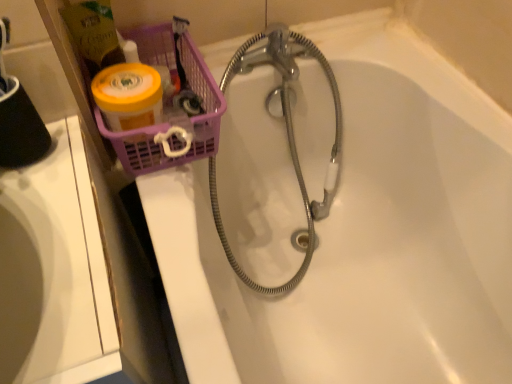
Question: From a real-world perspective, is white glossy sink at left physically located above or below white glossy bathtub at upper center?

Choices:
 (A) above
 (B) below

Answer: (B)

Question: Is white glossy sink at left taller or shorter than white glossy bathtub at upper center?

Choices:
 (A) short
 (B) tall

Answer: (B)

Question: Which object is positioned closest to the translucent plastic basket at upper left?

Choices:
 (A) white glossy bathtub at upper center
 (B) white glossy sink at left

Answer: (B)

Question: Based on their relative distances, which object is farther from the white glossy sink at left?

Choices:
 (A) white glossy bathtub at upper center
 (B) translucent plastic basket at upper left

Answer: (A)